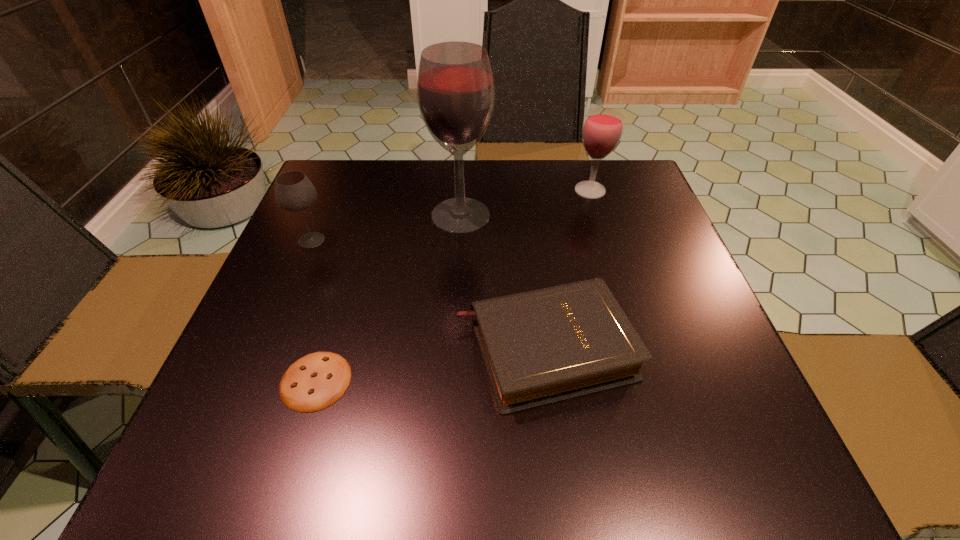
Where is `blank space located 0.270m on the right of the shorter wineglass`? blank space located 0.270m on the right of the shorter wineglass is located at coordinates (447, 240).

Where is `free space located 0.050m on the right of the fourth tallest object`? This screenshot has width=960, height=540. free space located 0.050m on the right of the fourth tallest object is located at coordinates (661, 348).

I want to click on vacant space located 0.210m on the right of the second object from left to right, so click(x=474, y=381).

At what (x,y) coordinates should I click in order to perform the action: click on alcohol present at the far edge. Please return your answer as a coordinate pair (x, y). The width and height of the screenshot is (960, 540). Looking at the image, I should click on (455, 89).

Image resolution: width=960 pixels, height=540 pixels. I want to click on wineglass at the far edge, so click(602, 128).

Locate an element on the screen. wineglass at the left edge is located at coordinates (294, 192).

At what (x,y) coordinates should I click in order to perform the action: click on cookie that is at the left edge. Please return your answer as a coordinate pair (x, y). This screenshot has height=540, width=960. Looking at the image, I should click on (317, 380).

Locate an element on the screen. wineglass located at the right edge is located at coordinates (602, 128).

This screenshot has height=540, width=960. I want to click on Bible that is at the right edge, so click(542, 346).

At what (x,y) coordinates should I click in order to perform the action: click on object that is positioned at the far right corner. Please return your answer as a coordinate pair (x, y). The height and width of the screenshot is (540, 960). Looking at the image, I should click on (602, 128).